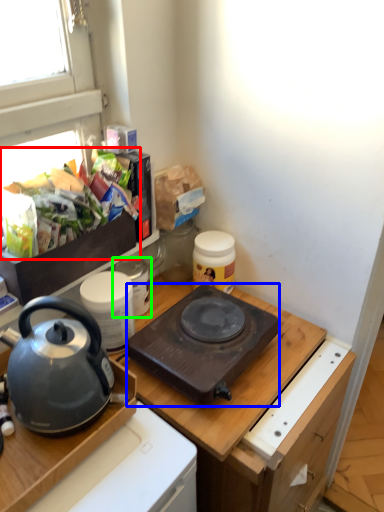
Question: Considering the real-world distances, which object is farthest from food (highlighted by a red box)? kitchen appliance (highlighted by a blue box) or appliance (highlighted by a green box)?

Choices:
 (A) kitchen appliance
 (B) appliance

Answer: (A)